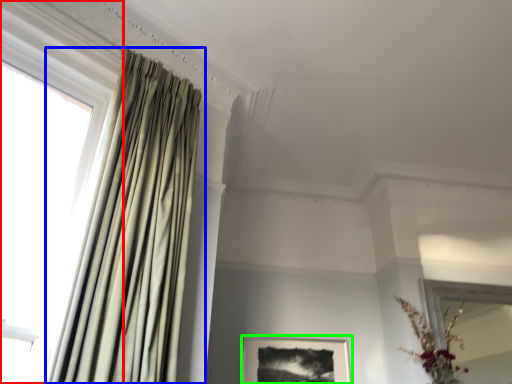
Question: Which is nearer to the window (highlighted by a red box)? curtain (highlighted by a blue box) or picture frame (highlighted by a green box).

Choices:
 (A) curtain
 (B) picture frame

Answer: (A)